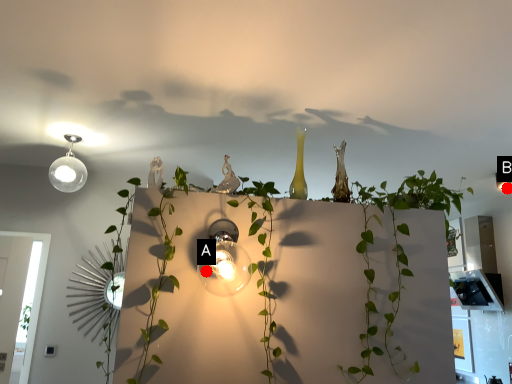
Question: Two points are circled on the image, labeled by A and B beside each circle. Which point is farther to the camera?

Choices:
 (A) A is further
 (B) B is further

Answer: (B)